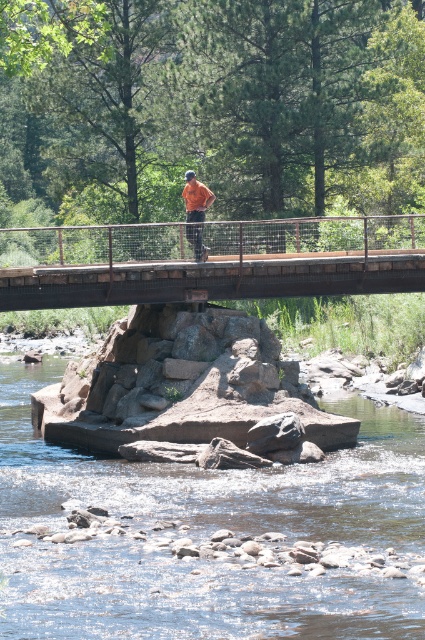
Consider the image. Who is more forward, (278, 244) or (190, 195)?

Point (190, 195) is more forward.

Can you confirm if brown wooden bridge at center is thinner than orange fabric shirt at center?

No.

Who is more forward, (x=127, y=237) or (x=187, y=211)?

Point (x=127, y=237) is more forward.

I want to click on brown wooden bridge at center, so click(209, 260).

Can you confirm if smooth rock bed at center is smaller than brown wooden bridge at center?

Yes, smooth rock bed at center is smaller than brown wooden bridge at center.

Who is more forward, (x=19, y=509) or (x=101, y=228)?

Point (x=19, y=509) is more forward.

Is point (277, 520) more distant than point (85, 227)?

No, (277, 520) is in front of (85, 227).

The width and height of the screenshot is (425, 640). I want to click on smooth rock bed at center, so click(x=207, y=536).

Between smooth rock bed at center and orange fabric shirt at center, which one is positioned lower?

smooth rock bed at center is lower down.

What do you see at coordinates (207, 536) in the screenshot? This screenshot has height=640, width=425. I see `smooth rock bed at center` at bounding box center [207, 536].

You are a GUI agent. You are given a task and a screenshot of the screen. Output one action in this format:
    pyautogui.click(x=<x>, y=<y>)
    Task: Click on the smooth rock bed at center
    This screenshot has height=640, width=425.
    Given the screenshot: What is the action you would take?
    pyautogui.click(x=207, y=536)